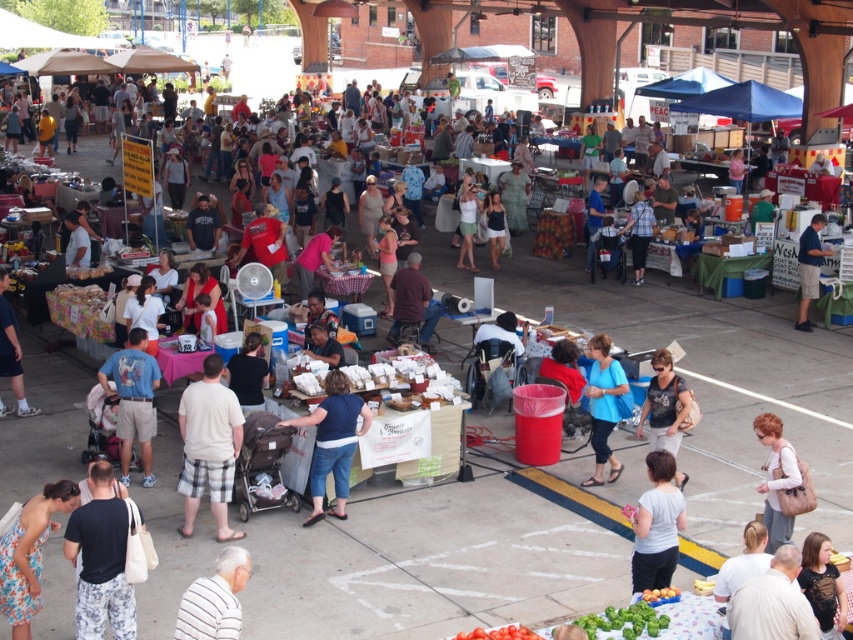
Based on the photo, you are standing at point (585, 484) in the market. You need to walk to the red trash bin. The market has a 10 meter safety distance rule due to current health guidelines. Is the distance between your current position and the red trash bin compliant with the safety distance requirement?

The distance between your current position at point (585, 484) and the red trash bin is 11.21 meters, which exceeds the 10 meter safety distance requirement. Therefore, it is compliant.

You are a delivery person who needs to deliver a package to the blue jeans at center. You are currently standing near the black cotton shirt at lower left. Given that your delivery cart is 2 meters long, can you navigate the path between these two points without moving any stalls?

The distance between the black cotton shirt at lower left and blue jeans at center is 2.74 meters. Since the delivery cart is 2 meters long, it can fit within the available space, so yes, you can navigate the path between them without moving any stalls.